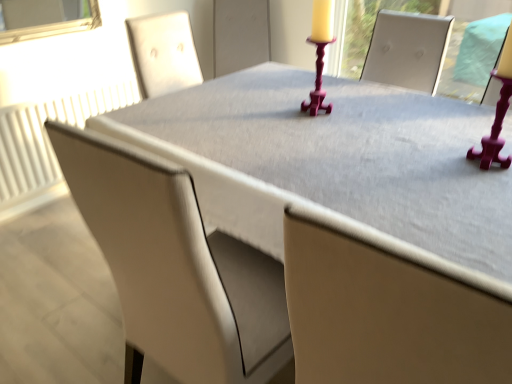
Where is `matte gray table at center`? matte gray table at center is located at coordinates (337, 167).

Find the location of a particular element. white textured radiator at left is located at coordinates (47, 137).

Looking at this image, are matte beige chair at center and white textured radiator at left far apart?

Absolutely, matte beige chair at center is distant from white textured radiator at left.

Which point is more distant from viewer, (58, 134) or (134, 82)?

The point (134, 82) is farther from the camera.

How far apart are matte beige chair at center and white textured radiator at left?

A distance of 1.57 meters exists between matte beige chair at center and white textured radiator at left.

Which object is further away from the camera, matte beige chair at center or white textured radiator at left?

Positioned behind is white textured radiator at left.

Choose the correct answer: Is matte beige chair at center inside matte gray table at center or outside it?

matte beige chair at center is not inside matte gray table at center, it's outside.

Consider the image. Between matte beige chair at center and matte gray table at center, which one has more height?

With more height is matte beige chair at center.

Visually, is matte beige chair at center positioned to the left or to the right of matte gray table at center?

matte beige chair at center is positioned on matte gray table at center's left side.

From a real-world perspective, between white textured radiator at left and matte beige chair at center, who is vertically lower?

From a 3D spatial view, white textured radiator at left is below.

Which of these two, white textured radiator at left or matte beige chair at center, is smaller?

Smaller between the two is white textured radiator at left.

Can we say white textured radiator at left lies outside matte beige chair at center?

Absolutely, white textured radiator at left is external to matte beige chair at center.

Can you see white textured radiator at left touching matte beige chair at center?

white textured radiator at left and matte beige chair at center are clearly separated.

Is there a large distance between matte gray table at center and matte beige chair at center?

No.

Do you think matte gray table at center is within matte beige chair at center, or outside of it?

The correct answer is: outside.

Can you tell me how much matte gray table at center and matte beige chair at center differ in facing direction?

0.205 degrees.

Is matte gray table at center facing away from matte beige chair at center?

matte gray table at center is not turned away from matte beige chair at center.

From the picture: From the image's perspective, between white textured radiator at left and matte gray table at center, who is located below?

matte gray table at center.

Is white textured radiator at left aimed at matte gray table at center?

Yes, white textured radiator at left is oriented towards matte gray table at center.

This screenshot has width=512, height=384. I want to click on radiator above the matte gray table at center (from the image's perspective), so click(47, 137).

Considering the points (271, 130) and (115, 88), which point is in front, point (271, 130) or point (115, 88)?

The point (271, 130) is in front.

Between matte gray table at center and white textured radiator at left, which one has smaller size?

white textured radiator at left.

Does matte gray table at center appear on the right side of white textured radiator at left?

Yes, matte gray table at center is to the right of white textured radiator at left.

Is matte gray table at center oriented towards white textured radiator at left?

No, matte gray table at center is not facing towards white textured radiator at left.

Find the location of a particular element. The height and width of the screenshot is (384, 512). radiator that appears behind the matte beige chair at center is located at coordinates (x=47, y=137).

Where is `chair located underneath the matte gray table at center (from a real-world perspective)`? The width and height of the screenshot is (512, 384). chair located underneath the matte gray table at center (from a real-world perspective) is located at coordinates (168, 263).

Looking at the image, which one is located closer to matte beige chair at center, white textured radiator at left or matte gray table at center?

matte gray table at center is positioned closer to the anchor matte beige chair at center.

Estimate the real-world distances between objects in this image. Which object is further from white textured radiator at left, matte beige chair at center or matte gray table at center?

Based on the image, matte beige chair at center appears to be further to white textured radiator at left.

Considering their positions, is matte gray table at center positioned further to matte beige chair at center than white textured radiator at left?

white textured radiator at left.

Which object lies nearer to the anchor point white textured radiator at left, matte gray table at center or matte beige chair at center?

Based on the image, matte gray table at center appears to be nearer to white textured radiator at left.

When comparing their distances from matte gray table at center, does white textured radiator at left or matte beige chair at center seem further?

white textured radiator at left is positioned further to the anchor matte gray table at center.

Estimate the real-world distances between objects in this image. Which object is further from matte gray table at center, matte beige chair at center or white textured radiator at left?

white textured radiator at left lies further to matte gray table at center than the other object.

This screenshot has height=384, width=512. I want to click on chair located between matte gray table at center and white textured radiator at left in the depth direction, so click(168, 263).